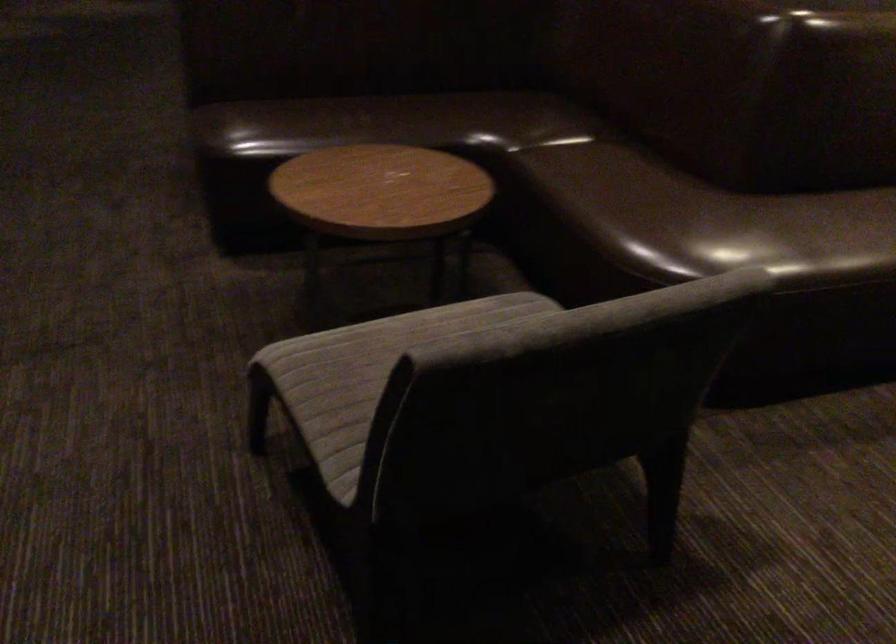
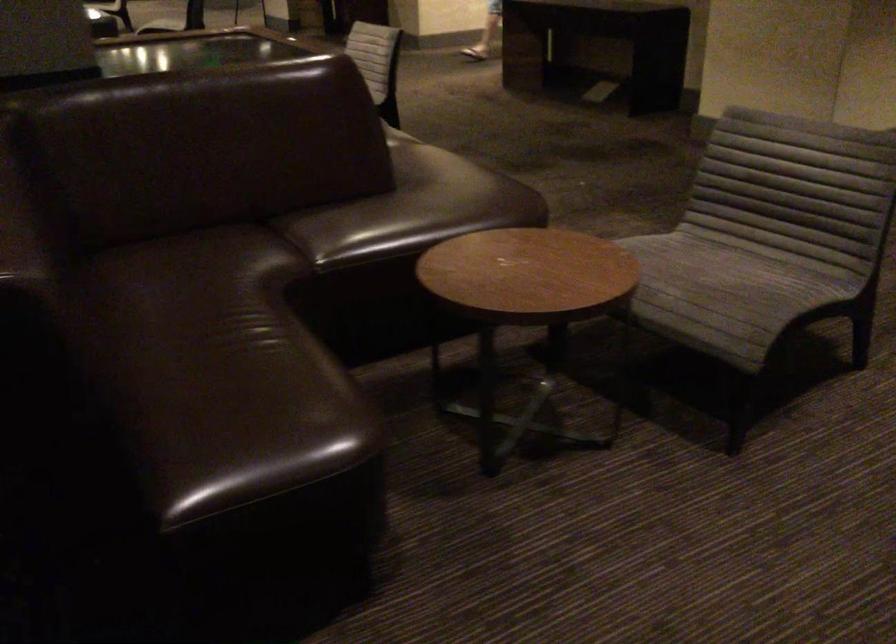
Where in the second image is the point corresponding to [298,96] from the first image?

(231, 399)